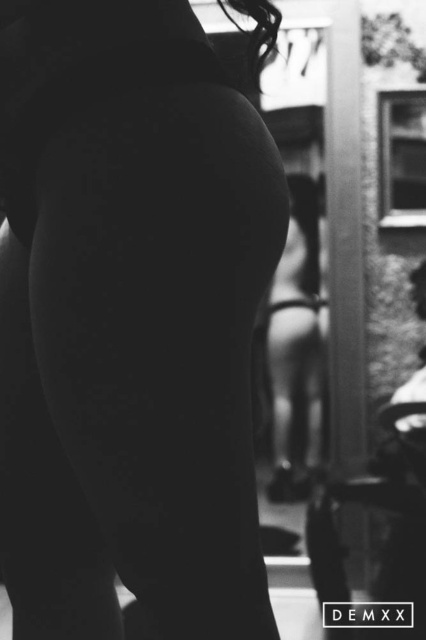
Question: Observing the image, what is the correct spatial positioning of smooth skin at center in reference to smooth skin girl at center?

Choices:
 (A) right
 (B) left

Answer: (B)

Question: Is smooth skin at center positioned before smooth skin girl at center?

Choices:
 (A) yes
 (B) no

Answer: (A)

Question: Is smooth skin at center behind smooth skin girl at center?

Choices:
 (A) yes
 (B) no

Answer: (B)

Question: Which object appears closest to the camera in this image?

Choices:
 (A) smooth skin girl at center
 (B) smooth skin at center

Answer: (B)